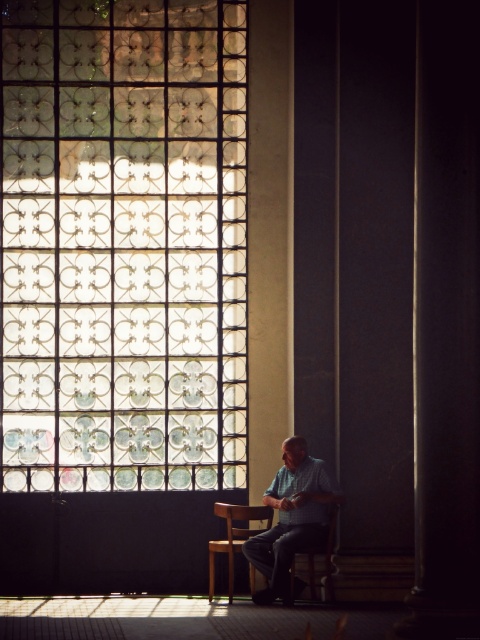
You are standing in the room and see the point marked at coordinate (233, 536). What object is this point located on?

The point marked at coordinate (233, 536) is located on the wooden chair at center.

You are planning to hang a large painting that requires a space wider than the clear glass window at upper left. Based on the scene, is there enough space next to the wooden chair at center to accommodate it?

The clear glass window at upper left is larger in size than the wooden chair at center, so the space next to the wooden chair at center may not be wide enough to accommodate a painting larger than the clear glass window at upper left.

You are standing in the room looking at the stained glass window. There are two points marked on the window, one at coordinates point (x=278, y=545) and another at point (x=229, y=572). Which of these points is closer to your eyes?

Point (x=278, y=545) is closer to the camera than point (x=229, y=572), so it is closer to your eyes.